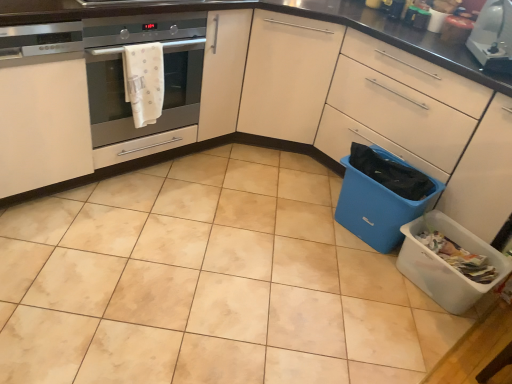
Locate an element on the screen. Image resolution: width=512 pixels, height=384 pixels. vacant space situated above blue plastic recycling bin at lower right, the first recycling bin positioned from the top (from a real-world perspective) is located at coordinates (394, 172).